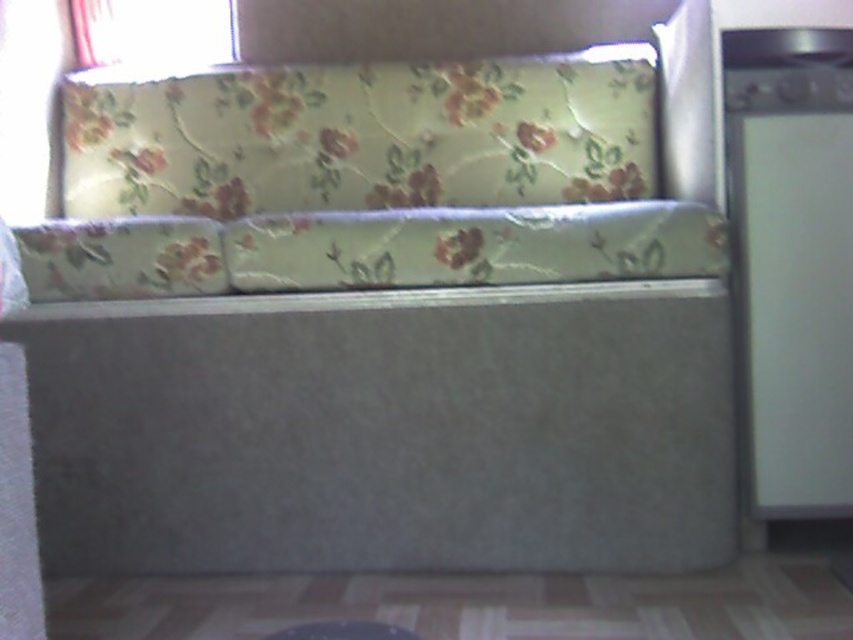
You are organizing a small party and need to place a 1.2 meter long tablecloth on the white matte refrigerator at right and the floral fabric pillow at center. Which object requires a longer tablecloth to cover its width?

The floral fabric pillow at center requires a longer tablecloth because the white matte refrigerator at right is narrower than the floral fabric pillow at center.

You are standing in the room and want to place a 5 feet long ladder between the white matte refrigerator at right and the white sheer curtain at upper left. Is there enough space for the ladder?

The distance between the white matte refrigerator at right and the white sheer curtain at upper left is 5.15 feet, which is slightly longer than the 5 feet ladder. Therefore, there is enough space to place the ladder between them.

You are arranging a dinner party and need to place a centerpiece on the table between the white matte refrigerator at right and the white sheer curtain at upper left. Which object should you place it closer to if you want it centered between them?

The white sheer curtain at upper left is on the left side of the white matte refrigerator at right, so to center the centerpiece between them, place it equidistant from both objects.